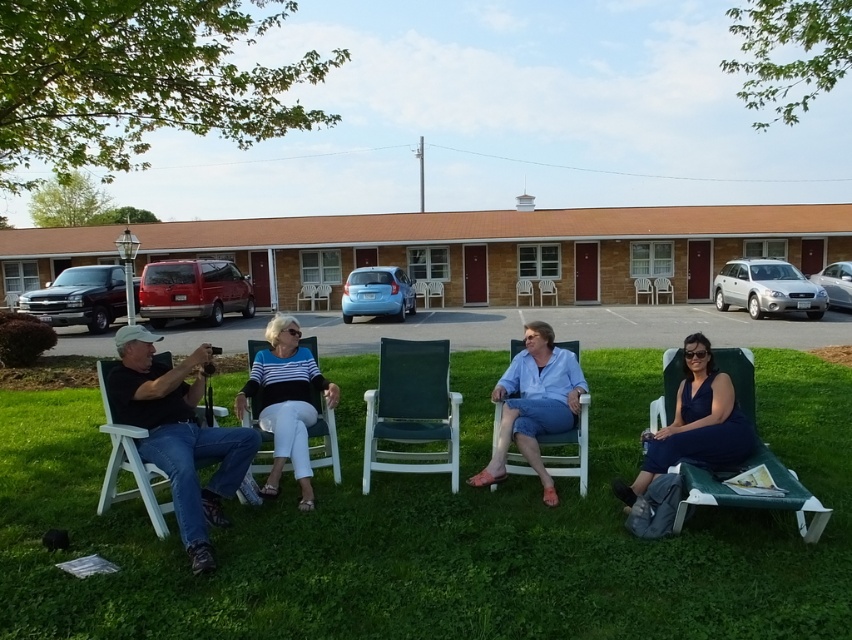
Question: Which point is closer to the camera taking this photo?

Choices:
 (A) (283, 369)
 (B) (700, 365)
 (C) (452, 461)
 (D) (102, 483)

Answer: (D)

Question: Which of these objects is positioned closest to the green grass at lower center?

Choices:
 (A) white plastic chair at left
 (B) striped sweater at center

Answer: (B)

Question: Which object is positioned farthest from the green grass at lower center?

Choices:
 (A) green mesh chair at center
 (B) matte blue dress at lower right
 (C) white plastic chair at left
 (D) green plastic lounge chair at lower right

Answer: (D)

Question: Is green grass at lower center to the left of white plastic chair at left from the viewer's perspective?

Choices:
 (A) no
 (B) yes

Answer: (A)

Question: Can you confirm if green grass at lower center is positioned above white plastic chair at center?

Choices:
 (A) no
 (B) yes

Answer: (A)

Question: Does green grass at lower center appear under green plastic lounge chair at lower right?

Choices:
 (A) yes
 (B) no

Answer: (A)